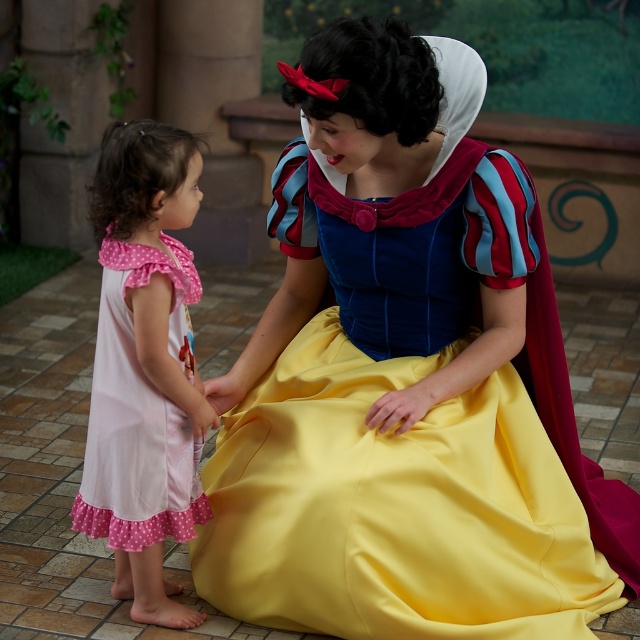
Is point (300, 195) farther from viewer compared to point (115, 529)?

Yes, it is.

Does point (500, 563) come farther from viewer compared to point (156, 502)?

No, (500, 563) is closer to viewer.

At what (x,y) coordinates should I click in order to perform the action: click on matte blue dress at center. Please return your answer as a coordinate pair (x, y). Looking at the image, I should click on (406, 378).